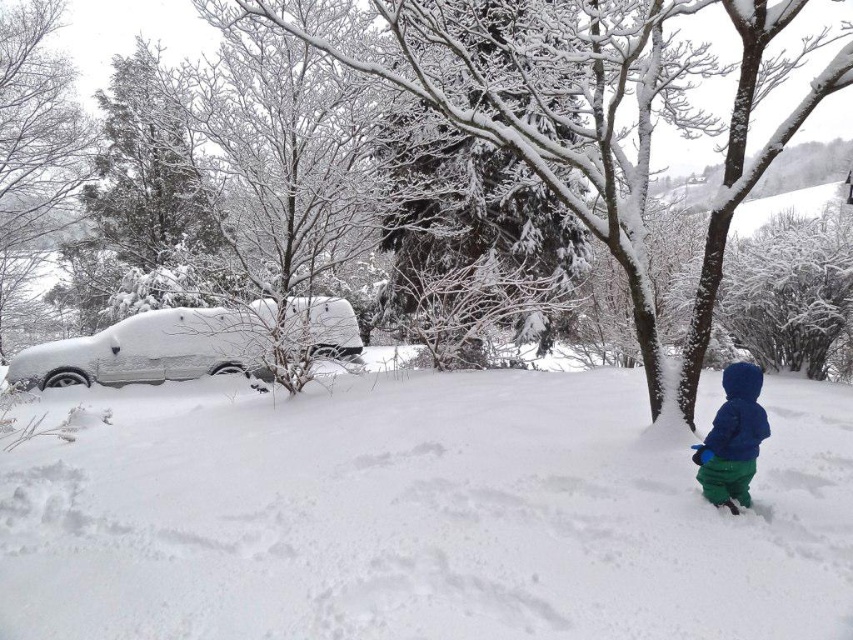
Question: Is snow-covered car at left wider than blue fleece jacket at lower right?

Choices:
 (A) yes
 (B) no

Answer: (B)

Question: Is white fluffy snow at lower left closer to the viewer compared to blue fleece jacket at lower right?

Choices:
 (A) no
 (B) yes

Answer: (B)

Question: Which object is closer to the camera taking this photo?

Choices:
 (A) blue fleece jacket at lower right
 (B) white fluffy snow at lower left

Answer: (B)

Question: Which object is positioned farthest from the white fluffy snow at lower left?

Choices:
 (A) blue fleece jacket at lower right
 (B) snow-covered car at left

Answer: (B)

Question: Is white fluffy snow at lower left below blue fleece jacket at lower right?

Choices:
 (A) no
 (B) yes

Answer: (B)

Question: Which of these objects is positioned farthest from the white fluffy snow at lower left?

Choices:
 (A) blue fleece jacket at lower right
 (B) snow-covered car at left

Answer: (B)